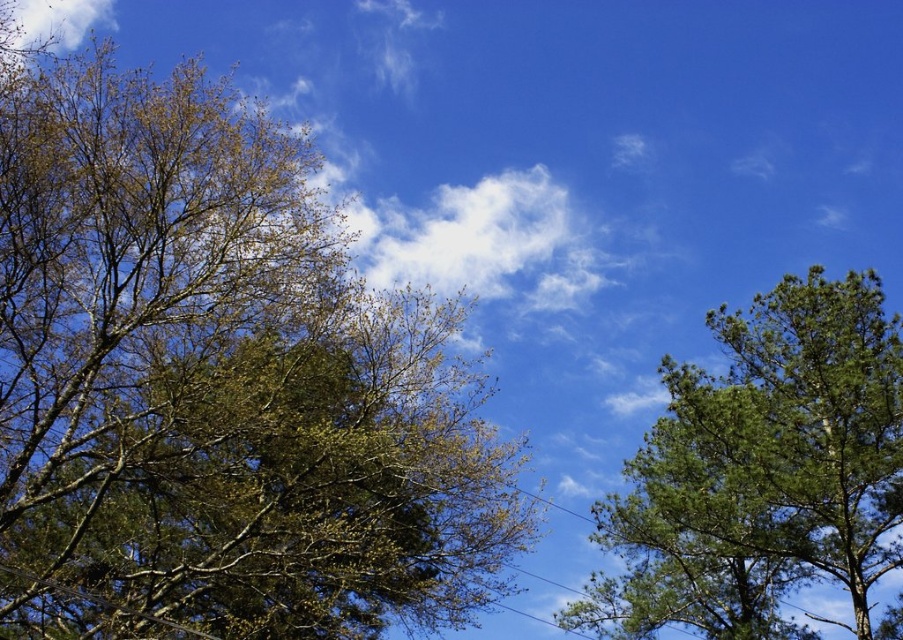
Does point (360, 445) lie behind point (766, 593)?

No.

Between green leafy tree at left and green textured tree at right, which one has more height?

With more height is green leafy tree at left.

Find the location of a particular element. This screenshot has height=640, width=903. green leafy tree at left is located at coordinates (217, 384).